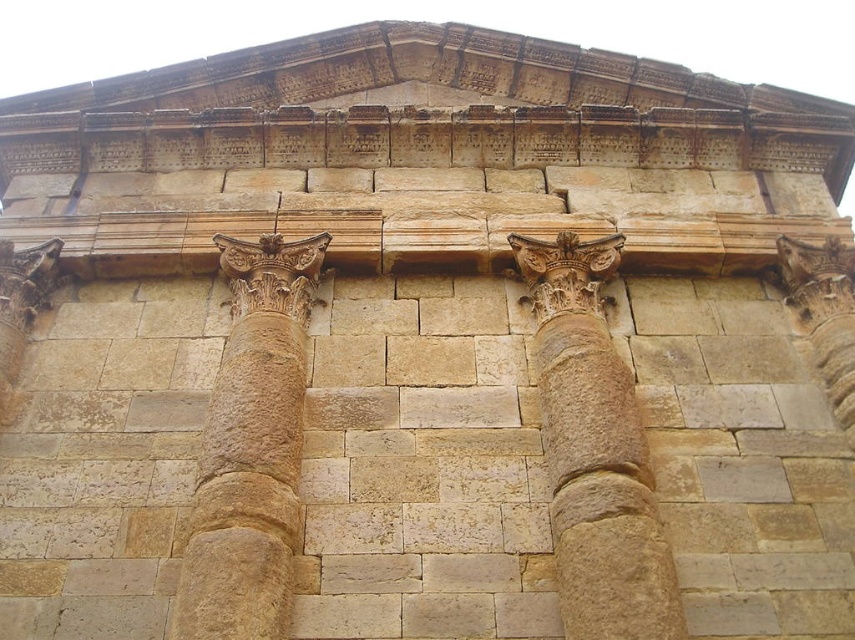
Question: Which point is closer to the camera?

Choices:
 (A) brown stone column at center
 (B) beige stone column at center

Answer: (A)

Question: Is beige stone column at center thinner than brown stone column at center?

Choices:
 (A) yes
 (B) no

Answer: (A)

Question: Where is beige stone column at center located in relation to brown stone column at center in the image?

Choices:
 (A) left
 (B) right

Answer: (B)

Question: Does beige stone column at center lie behind brown stone column at center?

Choices:
 (A) no
 (B) yes

Answer: (B)